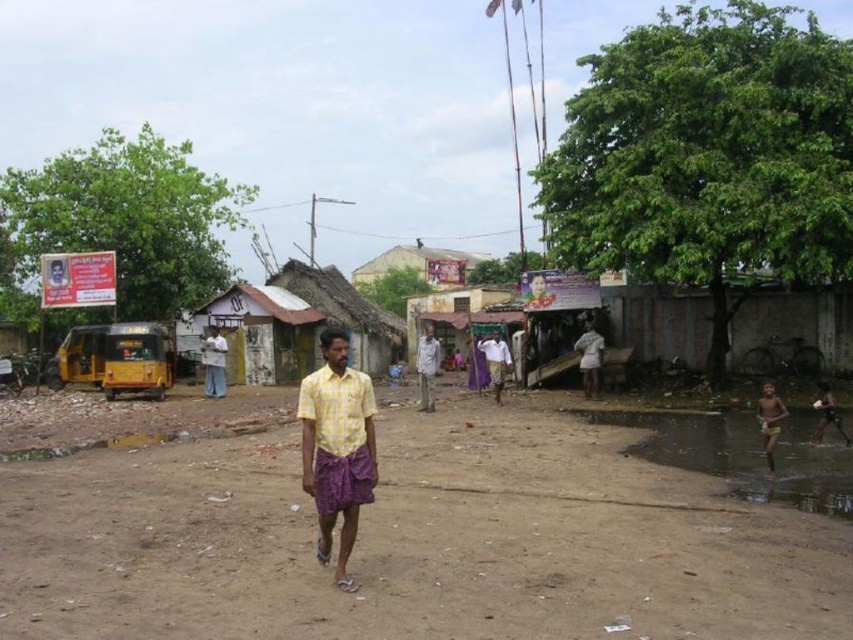
Where is the light blue fabric shirt at center located in the image?

The light blue fabric shirt at center is located at point [589,358] in the image.

You are standing at the origin point of the image. There is a point marked at coordinate (589, 358). What object does this point correspond to?

The point at coordinate (589, 358) corresponds to the light blue fabric shirt at center.